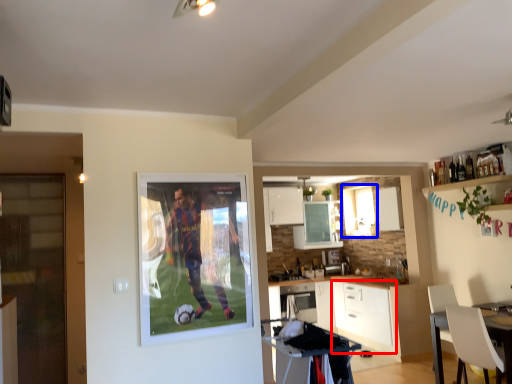
Question: Which object is closer to the camera taking this photo, cabinetry (highlighted by a red box) or window (highlighted by a blue box)?

Choices:
 (A) cabinetry
 (B) window

Answer: (A)